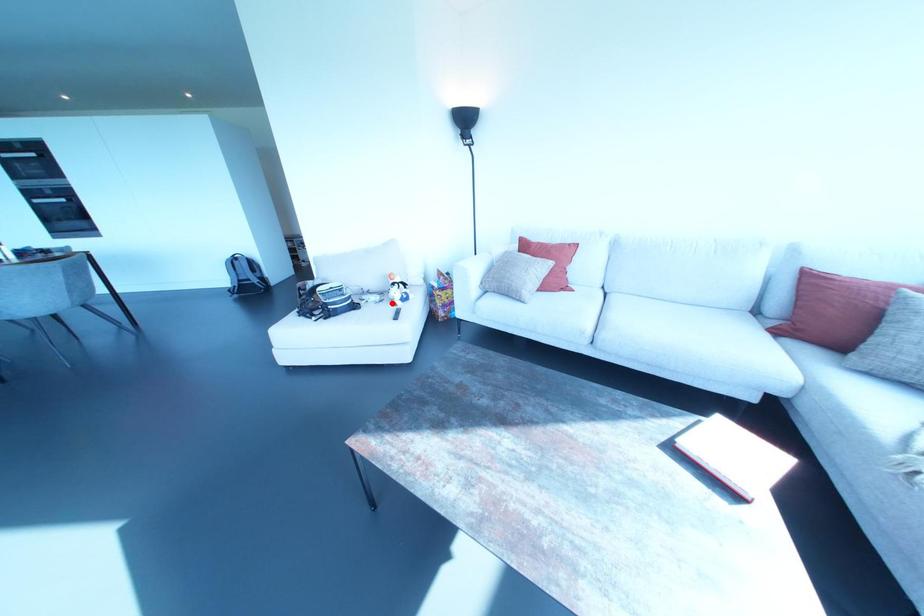
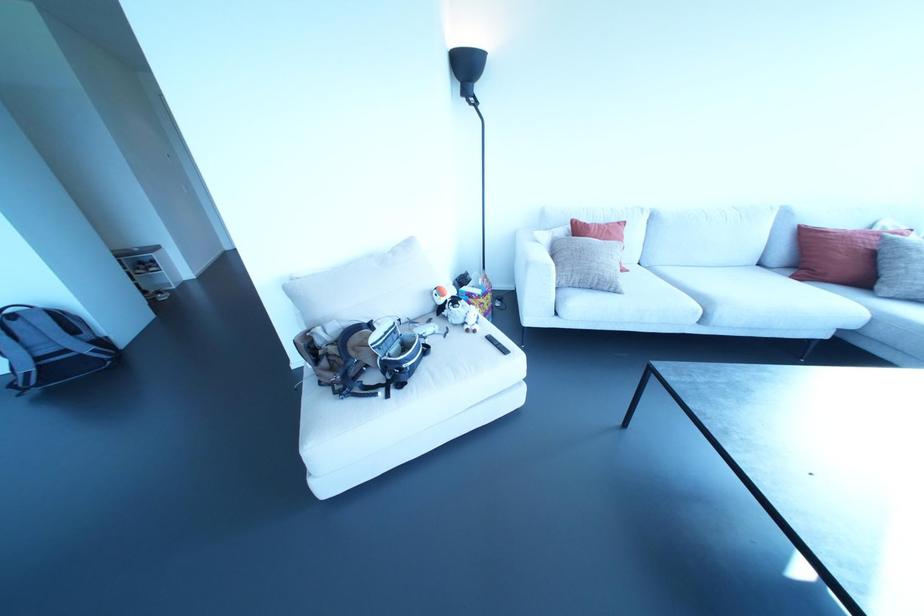
Where in the second image is the point corresponding to the highlighted location from the first image?

(467, 330)